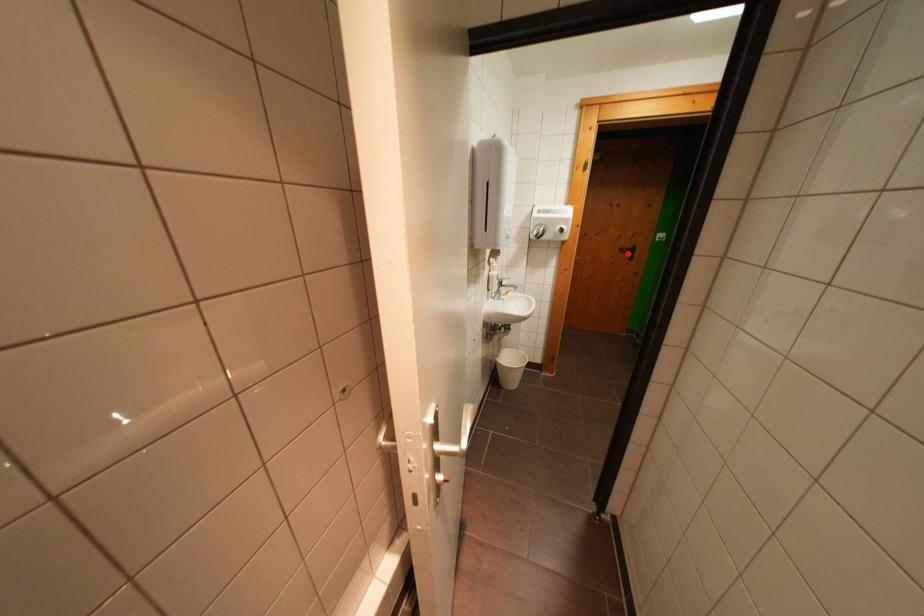
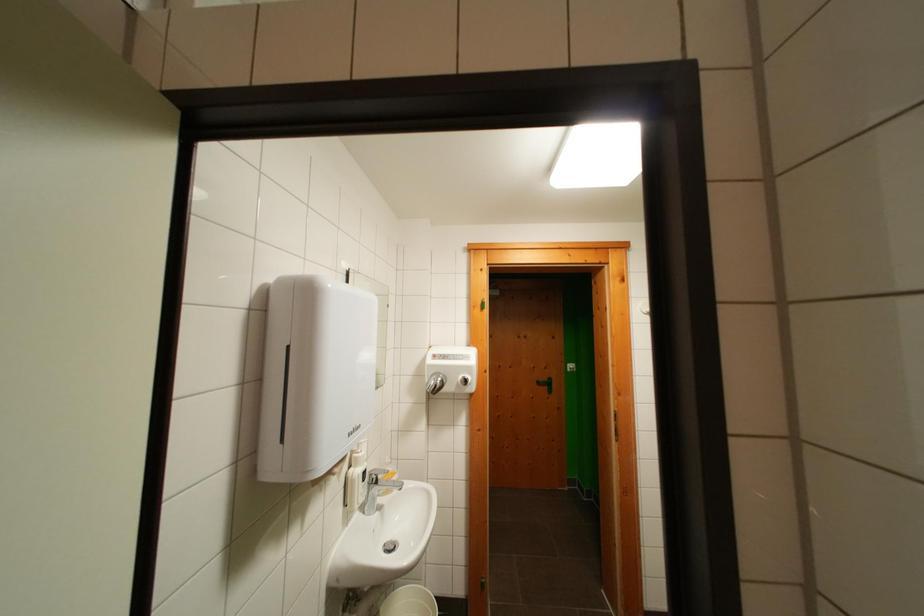
Locate, in the second image, the point that corresponds to the highlighted location in the first image.

(544, 387)